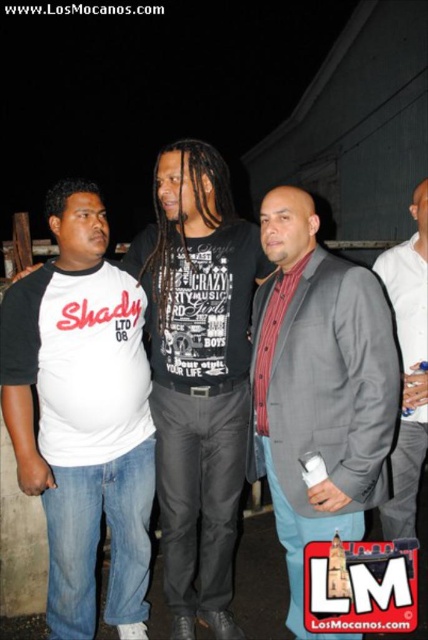
Question: Does white raglan shirt at left have a lesser width compared to gray fabric backpack at right?

Choices:
 (A) yes
 (B) no

Answer: (B)

Question: Which of the following is the closest to the observer?

Choices:
 (A) (169, 310)
 (B) (401, 285)

Answer: (A)

Question: Among these objects, which one is farthest from the camera?

Choices:
 (A) white raglan shirt at left
 (B) gray fabric backpack at right
 (C) gray wool blazer at center

Answer: (B)

Question: Can you confirm if white raglan shirt at left is positioned to the right of gray fabric backpack at right?

Choices:
 (A) no
 (B) yes

Answer: (A)

Question: Can you confirm if gray wool blazer at center is positioned above gray fabric backpack at right?

Choices:
 (A) no
 (B) yes

Answer: (A)

Question: Estimate the real-world distances between objects in this image. Which object is closer to the gray fabric backpack at right?

Choices:
 (A) white cotton t-shirt at left
 (B) gray wool blazer at center

Answer: (B)